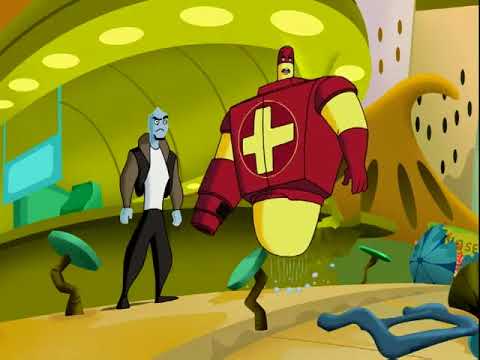
Find the location of a particular element. lights is located at coordinates (107, 40).